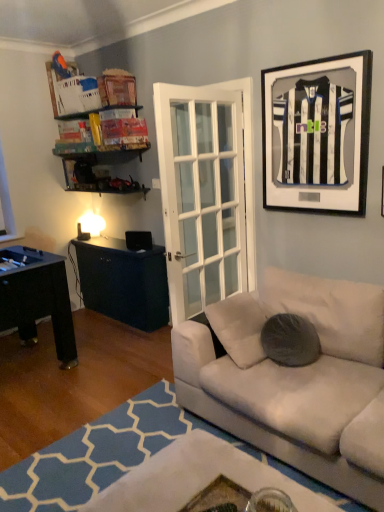
Question: From the image's perspective, is white fabric couch at lower right located beneath gray fuzzy pillow at center?

Choices:
 (A) no
 (B) yes

Answer: (B)

Question: Does white fabric couch at lower right have a lesser width compared to gray fuzzy pillow at center?

Choices:
 (A) yes
 (B) no

Answer: (B)

Question: Is gray fuzzy pillow at center surrounded by white fabric couch at lower right?

Choices:
 (A) yes
 (B) no

Answer: (B)

Question: Are white fabric couch at lower right and gray fuzzy pillow at center located far from each other?

Choices:
 (A) no
 (B) yes

Answer: (A)

Question: Considering the relative sizes of white fabric couch at lower right and gray fuzzy pillow at center in the image provided, is white fabric couch at lower right smaller than gray fuzzy pillow at center?

Choices:
 (A) no
 (B) yes

Answer: (A)

Question: Can you confirm if white fabric couch at lower right is taller than gray fuzzy pillow at center?

Choices:
 (A) yes
 (B) no

Answer: (B)

Question: From a real-world perspective, is black matte jersey at upper right on white fabric couch at lower right?

Choices:
 (A) no
 (B) yes

Answer: (B)

Question: Can you see black matte jersey at upper right touching white fabric couch at lower right?

Choices:
 (A) no
 (B) yes

Answer: (A)

Question: From the image's perspective, is black matte jersey at upper right on top of white fabric couch at lower right?

Choices:
 (A) yes
 (B) no

Answer: (A)

Question: Is black matte jersey at upper right to the left of white fabric couch at lower right from the viewer's perspective?

Choices:
 (A) no
 (B) yes

Answer: (A)

Question: Is black matte jersey at upper right smaller than white fabric couch at lower right?

Choices:
 (A) yes
 (B) no

Answer: (A)

Question: Is the position of black matte jersey at upper right less distant than that of white fabric couch at lower right?

Choices:
 (A) no
 (B) yes

Answer: (A)

Question: From a real-world perspective, is white fabric couch at lower right on top of black matte jersey at upper right?

Choices:
 (A) yes
 (B) no

Answer: (B)